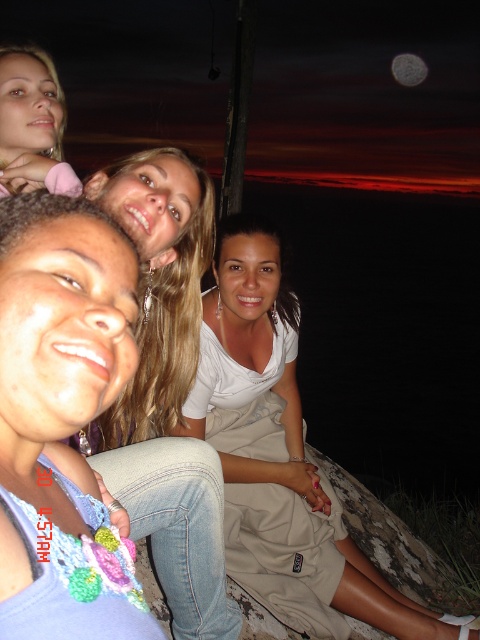
Question: In this image, where is white cotton dress at center located relative to matte pink hair clip at upper left?

Choices:
 (A) below
 (B) above

Answer: (A)

Question: Can you confirm if white cotton dress at center is positioned to the right of matte pink hair clip at upper left?

Choices:
 (A) yes
 (B) no

Answer: (A)

Question: Among these objects, which one is farthest from the camera?

Choices:
 (A) white cotton dress at center
 (B) matte purple shirt at center

Answer: (A)

Question: Considering the relative positions of white cotton dress at center and matte pink hair clip at upper left in the image provided, where is white cotton dress at center located with respect to matte pink hair clip at upper left?

Choices:
 (A) right
 (B) left

Answer: (A)

Question: Which point is farther from the camera taking this photo?

Choices:
 (A) (54, 472)
 (B) (36, 99)
 (C) (337, 593)

Answer: (C)

Question: Which point is farther from the camera taking this photo?

Choices:
 (A) (120, 611)
 (B) (29, 88)
 (C) (214, 371)

Answer: (C)